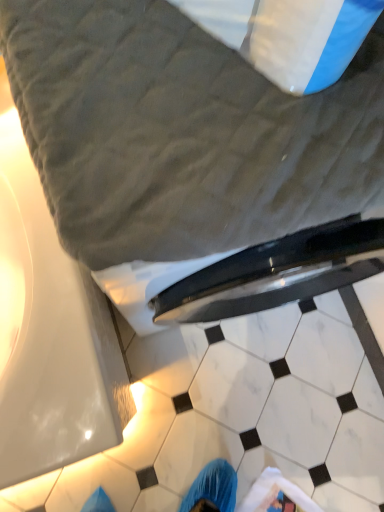
Question: Is gray quilted bed at upper center in front of white marble tile at lower center, acting as the 1th tile starting from the back?

Choices:
 (A) yes
 (B) no

Answer: (A)

Question: From the image's perspective, is gray quilted bed at upper center over white marble tile at lower center, which appears as the 2th tile when viewed from the front?

Choices:
 (A) no
 (B) yes

Answer: (B)

Question: Is white marble tile at lower center, which appears as the 2th tile when viewed from the front, surrounded by gray quilted bed at upper center?

Choices:
 (A) yes
 (B) no

Answer: (B)

Question: Does gray quilted bed at upper center have a smaller size compared to white marble tile at lower center, acting as the 1th tile starting from the back?

Choices:
 (A) no
 (B) yes

Answer: (A)

Question: Considering the relative sizes of gray quilted bed at upper center and white marble tile at lower center, acting as the 1th tile starting from the back, in the image provided, is gray quilted bed at upper center taller than white marble tile at lower center, acting as the 1th tile starting from the back,?

Choices:
 (A) no
 (B) yes

Answer: (B)

Question: Can you confirm if gray quilted bed at upper center is bigger than white marble tile at lower center, acting as the 1th tile starting from the back?

Choices:
 (A) yes
 (B) no

Answer: (A)

Question: From a real-world perspective, is white marble tile at lower center, acting as the 1th tile starting from the back, beneath gray quilted bed at upper center?

Choices:
 (A) yes
 (B) no

Answer: (A)

Question: Can you confirm if white marble tile at lower center, acting as the 1th tile starting from the back, is shorter than gray quilted bed at upper center?

Choices:
 (A) no
 (B) yes

Answer: (B)

Question: Is white marble tile at lower center, which appears as the 2th tile when viewed from the front, oriented towards gray quilted bed at upper center?

Choices:
 (A) no
 (B) yes

Answer: (A)

Question: From a real-world perspective, is white marble tile at lower center, which appears as the 2th tile when viewed from the front, over gray quilted bed at upper center?

Choices:
 (A) yes
 (B) no

Answer: (B)

Question: Is the depth of white marble tile at lower center, which appears as the 2th tile when viewed from the front, less than that of gray quilted bed at upper center?

Choices:
 (A) no
 (B) yes

Answer: (A)

Question: Considering the relative positions of white marble tile at lower center, which appears as the 2th tile when viewed from the front, and gray quilted bed at upper center in the image provided, is white marble tile at lower center, which appears as the 2th tile when viewed from the front, to the right of gray quilted bed at upper center from the viewer's perspective?

Choices:
 (A) yes
 (B) no

Answer: (A)

Question: Does white marble tile at center, which ranks as the 2th tile in back-to-front order, appear on the right side of gray quilted bed at upper center?

Choices:
 (A) no
 (B) yes

Answer: (A)